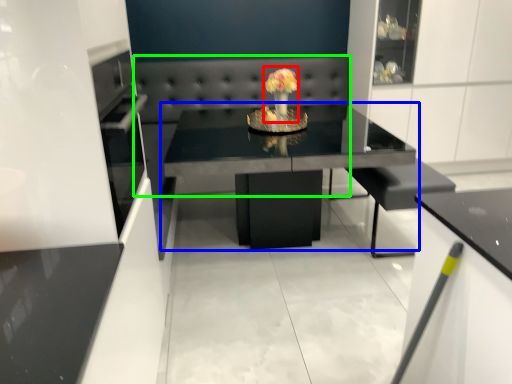
Question: Considering the real-world distances, which object is closest to floral arrangement (highlighted by a red box)? table (highlighted by a blue box) or couch (highlighted by a green box).

Choices:
 (A) table
 (B) couch

Answer: (B)